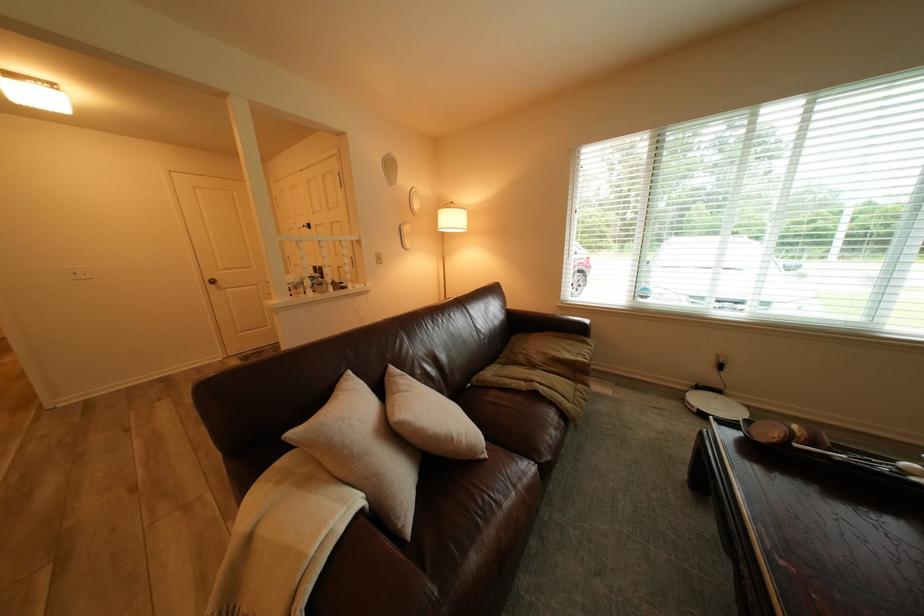
I want to click on white robot vacuum, so click(714, 399).